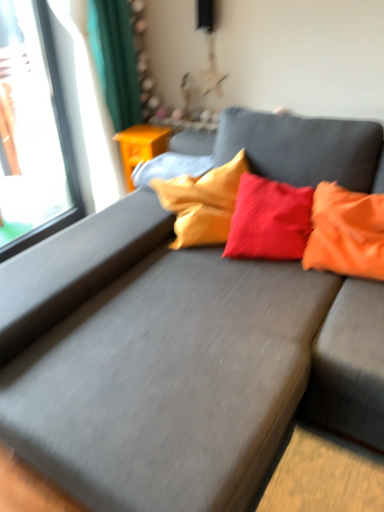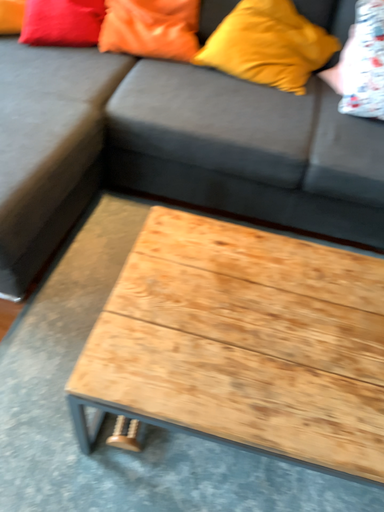
Question: How did the camera likely rotate when shooting the video?

Choices:
 (A) rotated right
 (B) rotated left

Answer: (A)